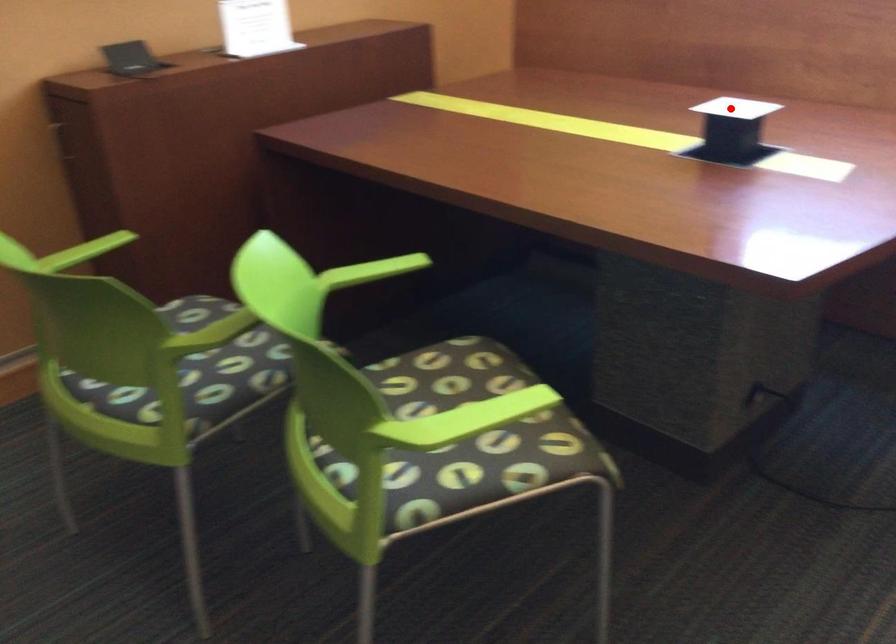
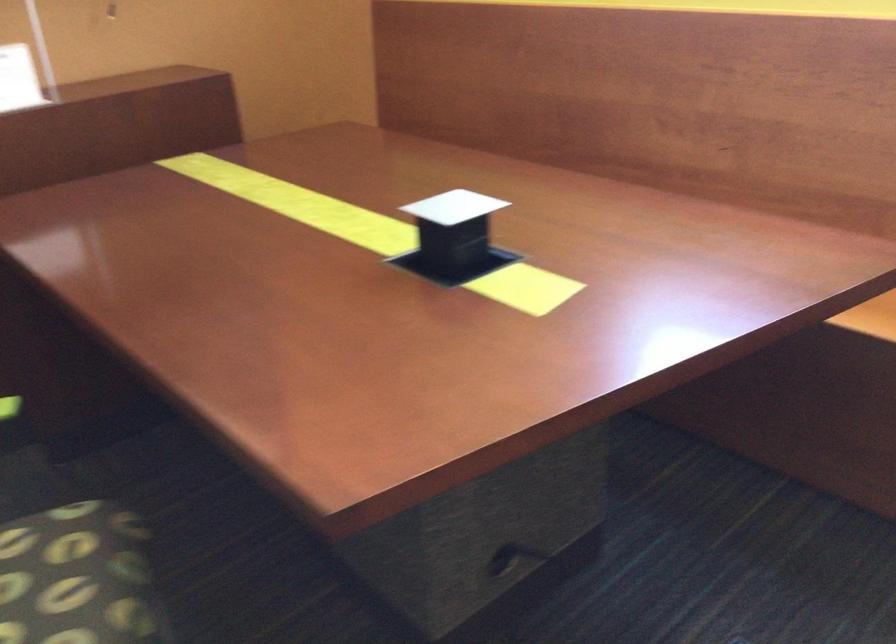
Where in the second image is the point corresponding to the highlighted location from the first image?

(453, 207)